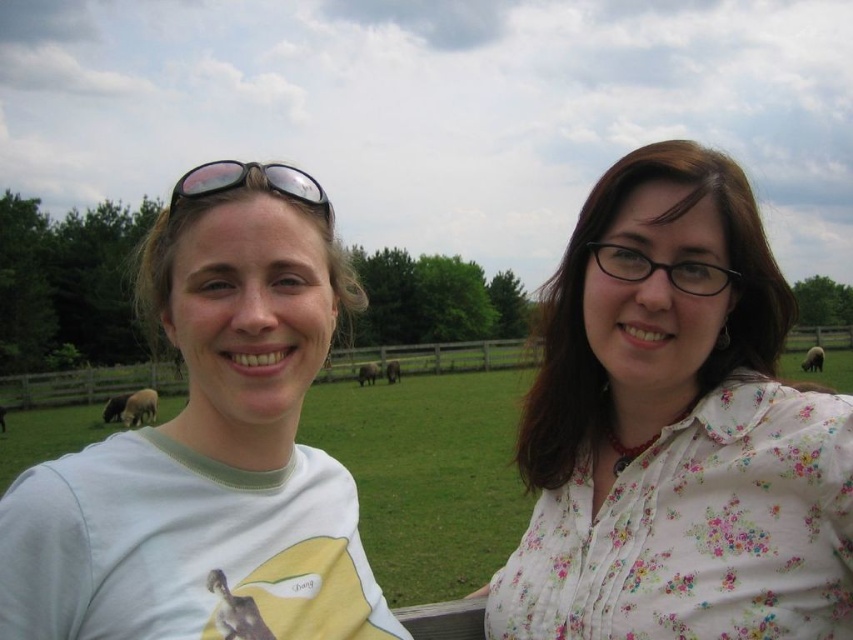
Question: Can you confirm if floral cotton blouse at upper right is positioned below black reflective sunglasses at upper center?

Choices:
 (A) yes
 (B) no

Answer: (A)

Question: Does floral cotton blouse at upper right appear on the right side of white cotton t-shirt at left?

Choices:
 (A) yes
 (B) no

Answer: (A)

Question: Which object is closer to the camera taking this photo?

Choices:
 (A) floral cotton blouse at upper right
 (B) black reflective sunglasses at upper center

Answer: (A)

Question: Where is white cotton t-shirt at left located in relation to black reflective sunglasses at upper center in the image?

Choices:
 (A) above
 (B) below

Answer: (B)

Question: Among these points, which one is nearest to the camera?

Choices:
 (A) (172, 211)
 (B) (254, 428)

Answer: (A)

Question: Among these objects, which one is farthest from the camera?

Choices:
 (A) floral cotton blouse at upper right
 (B) white cotton t-shirt at left

Answer: (A)